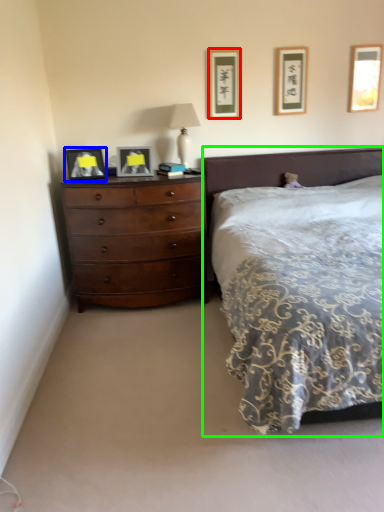
Question: Which object is the farthest from picture frame (highlighted by a red box)? Choose among these: picture frame (highlighted by a blue box) or bed (highlighted by a green box).

Choices:
 (A) picture frame
 (B) bed

Answer: (A)